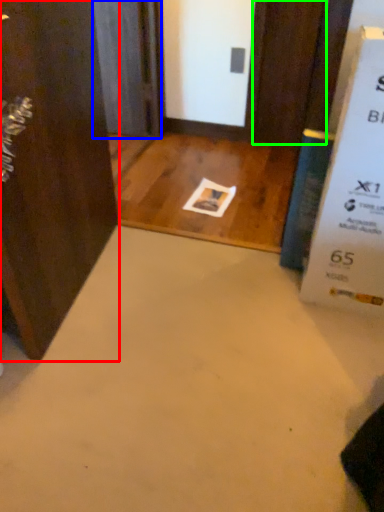
Question: Which object is positioned closest to door (highlighted by a red box)? Select from screen door (highlighted by a blue box) and door (highlighted by a green box).

Choices:
 (A) screen door
 (B) door

Answer: (A)